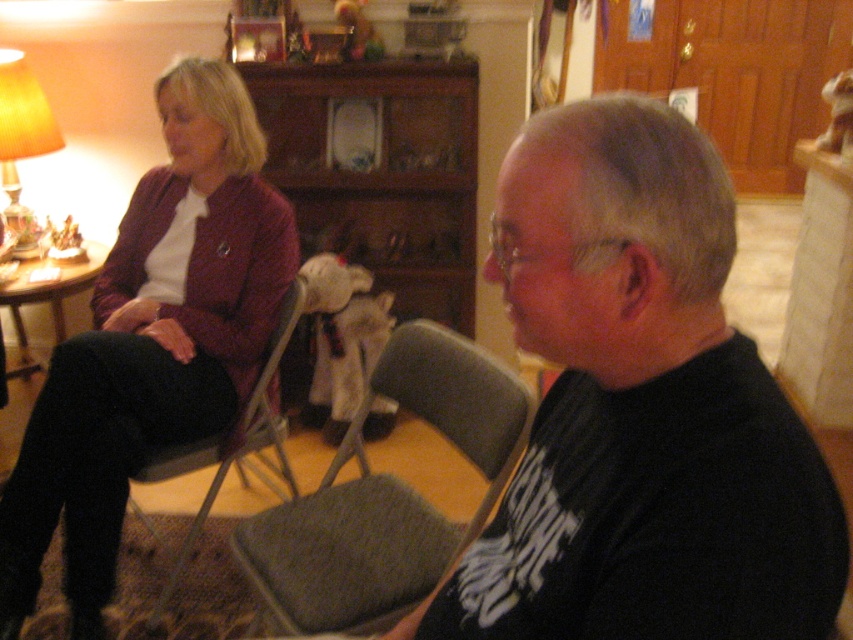
Question: Which of the following is the farthest from the observer?

Choices:
 (A) matte burgundy sweater at left
 (B) matte yellow lampshade at left
 (C) gray fabric chair at center

Answer: (B)

Question: Can you confirm if gray fabric chair at left is bigger than matte yellow lampshade at left?

Choices:
 (A) no
 (B) yes

Answer: (B)

Question: In this image, where is black matte shirt at center located relative to matte yellow lampshade at left?

Choices:
 (A) above
 (B) below

Answer: (B)

Question: Can you confirm if gray fabric chair at center is positioned above gray fabric chair at left?

Choices:
 (A) yes
 (B) no

Answer: (B)

Question: Which object is the closest to the gray fabric chair at left?

Choices:
 (A) matte burgundy sweater at left
 (B) matte yellow lampshade at left
 (C) gray fabric chair at center

Answer: (A)

Question: Which object is positioned closest to the gray fabric chair at left?

Choices:
 (A) matte burgundy sweater at left
 (B) black matte shirt at center
 (C) matte yellow lampshade at left
 (D) gray fabric chair at center

Answer: (A)